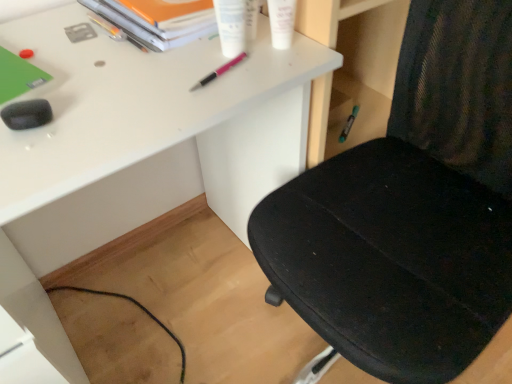
This screenshot has height=384, width=512. What are the coordinates of `free spot behind pink metallic pen at upper center, the third stationery positioned from the left` in the screenshot? It's located at (210, 40).